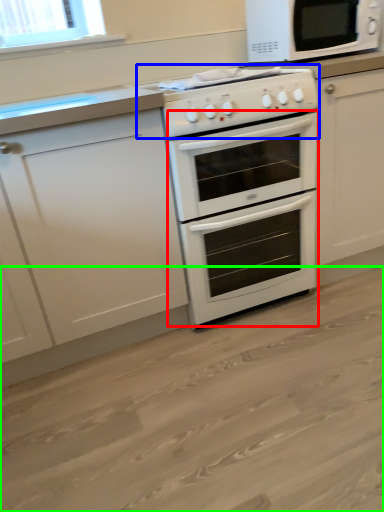
Question: Which object is positioned closest to oven (highlighted by a red box)? Select from gas stove (highlighted by a blue box) and plain (highlighted by a green box).

Choices:
 (A) gas stove
 (B) plain

Answer: (A)